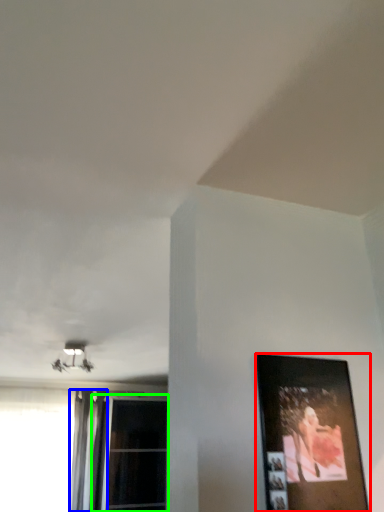
Question: Estimate the real-world distances between objects in this image. Which object is farther from picture frame (highlighted by a red box), curtain (highlighted by a blue box) or window (highlighted by a green box)?

Choices:
 (A) curtain
 (B) window

Answer: (B)